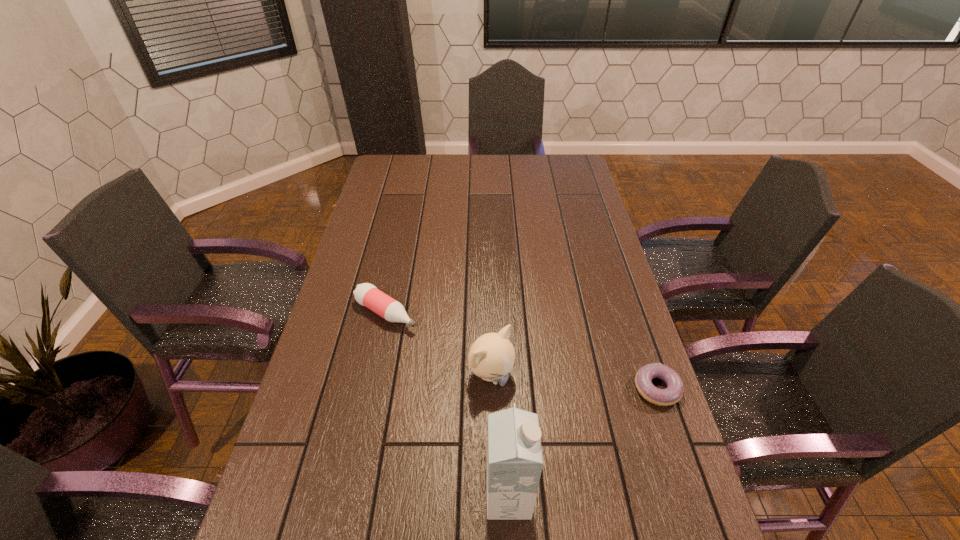
Locate an element on the screen. vacant space on the desktop that is between the nearest object and the doughnut and is positioned with the cap open on the farthest object is located at coordinates (585, 441).

Where is `vacant spot on the desktop that is between the nearest object and the doughnut and is positioned on the face of the second tallest object`? vacant spot on the desktop that is between the nearest object and the doughnut and is positioned on the face of the second tallest object is located at coordinates (578, 446).